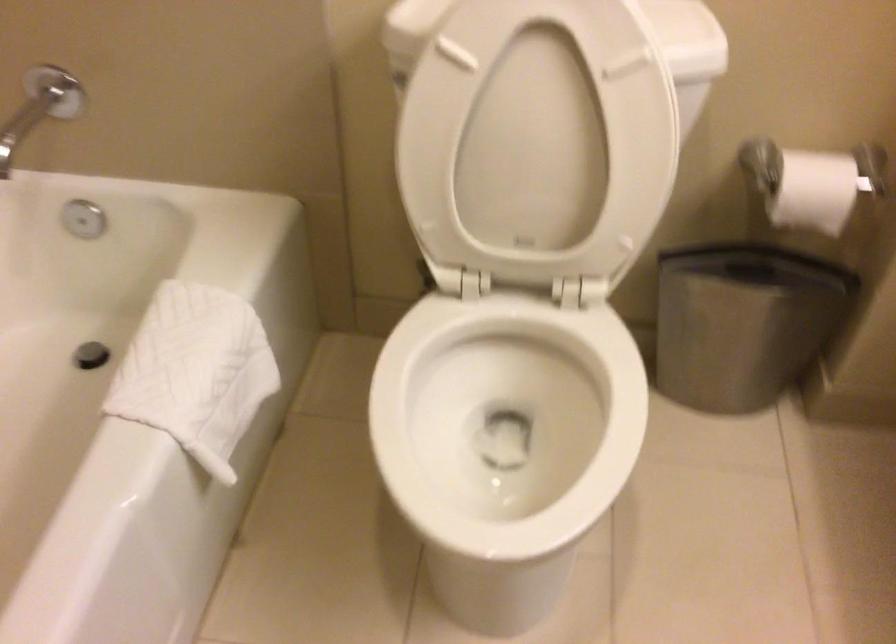
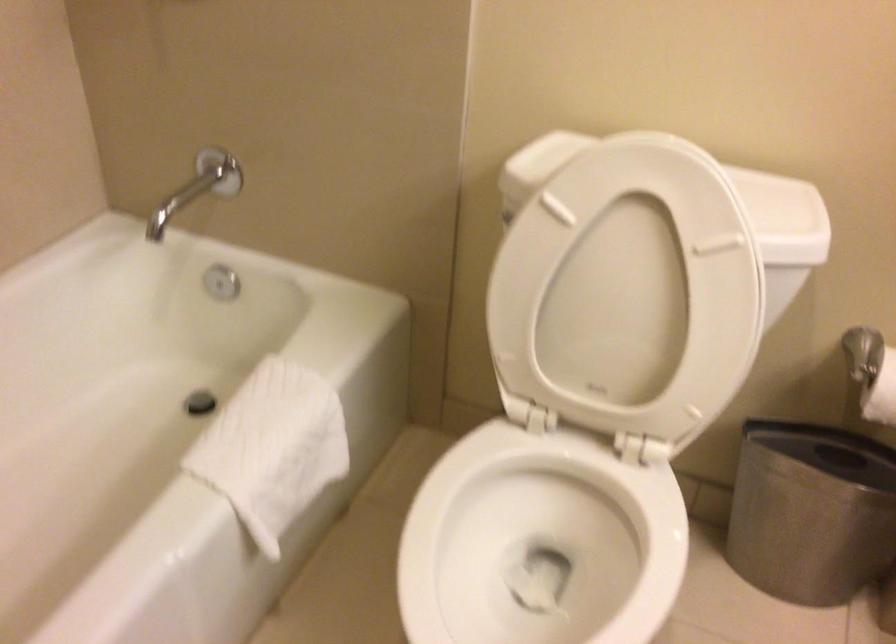
Locate, in the second image, the point that corresponds to (x=787, y=192) in the first image.

(881, 393)